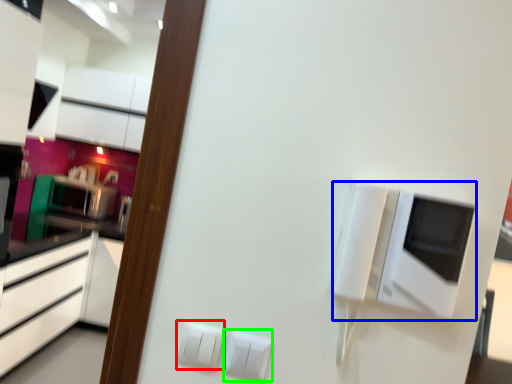
Question: Which object is the farthest from electric outlet (highlighted by a red box)? Choose among these: appliance (highlighted by a blue box) or electric outlet (highlighted by a green box).

Choices:
 (A) appliance
 (B) electric outlet

Answer: (A)